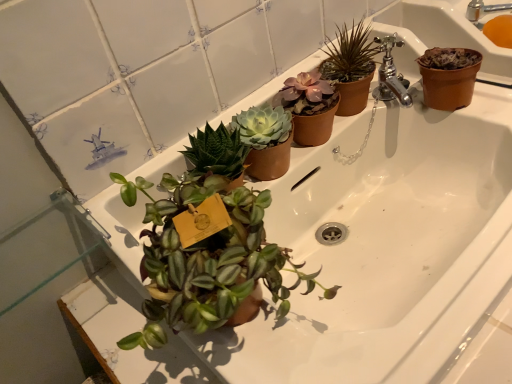
Question: Which is correct: metallic silver faucet at upper right is inside matte brown pot at upper center, or outside of it?

Choices:
 (A) outside
 (B) inside

Answer: (A)

Question: Is metallic silver faucet at upper right taller or shorter than matte brown pot at upper center?

Choices:
 (A) tall
 (B) short

Answer: (B)

Question: Is point (482, 6) positioned closer to the camera than point (361, 102)?

Choices:
 (A) farther
 (B) closer

Answer: (A)

Question: Do you think matte brown pot at upper center is within metallic silver faucet at upper right, or outside of it?

Choices:
 (A) outside
 (B) inside

Answer: (A)

Question: From their relative heights in the image, would you say matte brown pot at upper center is taller or shorter than metallic silver faucet at upper right?

Choices:
 (A) tall
 (B) short

Answer: (A)

Question: From a real-world perspective, is matte brown pot at upper center above or below metallic silver faucet at upper right?

Choices:
 (A) below
 (B) above

Answer: (B)

Question: Is matte brown pot at upper center in front of or behind metallic silver faucet at upper right in the image?

Choices:
 (A) front
 (B) behind

Answer: (A)